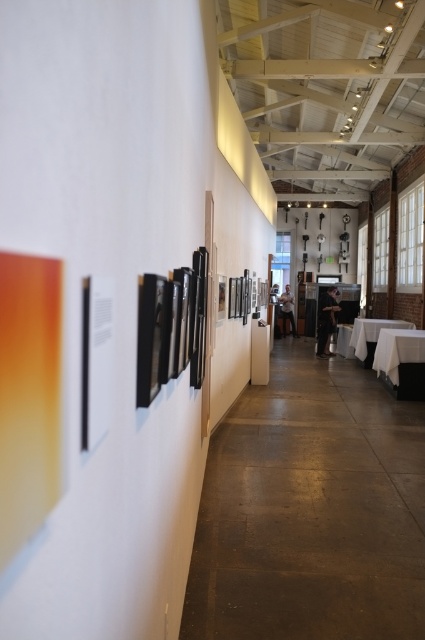
Question: Based on their relative distances, which object is nearer to the white cloth-covered table at right?

Choices:
 (A) white glossy table at center
 (B) white cloth table at center

Answer: (B)

Question: Where is white cloth table at center located in relation to white glossy table at center in the image?

Choices:
 (A) above
 (B) below

Answer: (A)

Question: Which of the following is the farthest from the observer?

Choices:
 (A) (348, 339)
 (B) (405, 353)
 (C) (396, 324)

Answer: (A)

Question: Is white cloth-covered table at right bigger than white cloth table at center?

Choices:
 (A) yes
 (B) no

Answer: (B)

Question: Is white cloth-covered table at right closer to the viewer compared to white cloth table at center?

Choices:
 (A) no
 (B) yes

Answer: (B)

Question: Which point is farther from the camera taking this photo?

Choices:
 (A) (360, 323)
 (B) (336, 349)
 (C) (399, 342)

Answer: (B)